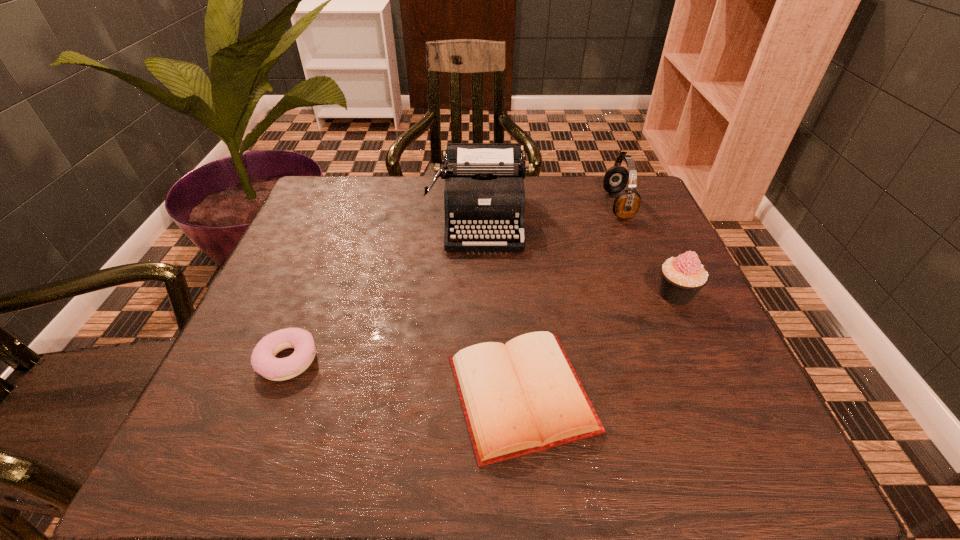
At what (x,y) coordinates should I click in order to perform the action: click on object present at the far right corner. Please return your answer as a coordinate pair (x, y). This screenshot has height=540, width=960. Looking at the image, I should click on (627, 203).

The image size is (960, 540). I want to click on vacant space at the far edge of the desktop, so 426,215.

In the image, there is a desktop. At what (x,y) coordinates should I click in order to perform the action: click on vacant space at the near edge. Please return your answer as a coordinate pair (x, y). This screenshot has height=540, width=960. Looking at the image, I should click on [x=562, y=465].

In the image, there is a desktop. Find the location of `free space at the left edge`. free space at the left edge is located at coordinates (269, 321).

Locate an element on the screen. blank space at the right edge of the desktop is located at coordinates (636, 292).

What are the coordinates of `free space at the far right corner` in the screenshot? It's located at (605, 215).

Find the location of a particular element. Image resolution: width=960 pixels, height=540 pixels. blank region between the cupcake and the doughnut is located at coordinates (482, 327).

Where is `free space between the cupcake and the typewriter`? The height and width of the screenshot is (540, 960). free space between the cupcake and the typewriter is located at coordinates point(578,256).

The width and height of the screenshot is (960, 540). What are the coordinates of `free spot between the Bible and the cupcake` in the screenshot? It's located at (598, 344).

Identify the location of empty location between the shortest object and the third farthest object. Image resolution: width=960 pixels, height=540 pixels. (598, 344).